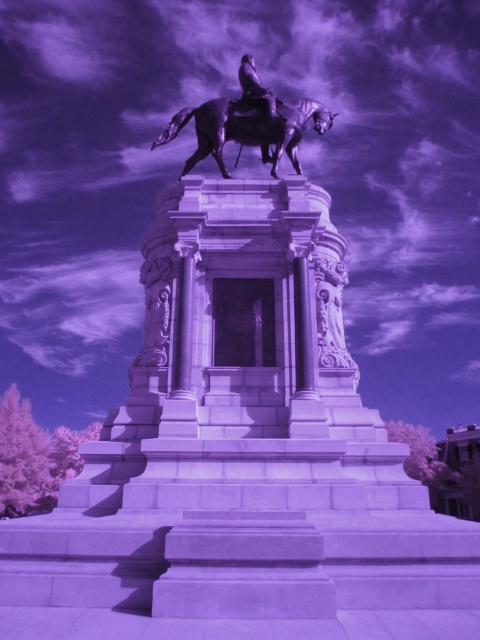
Question: Which of the following is the farthest from the observer?

Choices:
 (A) shiny bronze horse at upper center
 (B) white marble statue at upper right
 (C) polished bronze horse at center

Answer: (A)

Question: Can you confirm if polished bronze horse at center is positioned below white marble statue at upper right?

Choices:
 (A) yes
 (B) no

Answer: (B)

Question: Considering the real-world distances, which object is farthest from the polished bronze horse at center?

Choices:
 (A) shiny bronze horse at upper center
 (B) white marble statue at upper right

Answer: (B)

Question: Which of the following is the farthest from the observer?

Choices:
 (A) (251, 65)
 (B) (331, 264)

Answer: (A)

Question: Does white marble statue at upper right appear under shiny bronze horse at upper center?

Choices:
 (A) no
 (B) yes

Answer: (B)

Question: Does polished bronze horse at center appear over white marble statue at upper right?

Choices:
 (A) no
 (B) yes

Answer: (B)